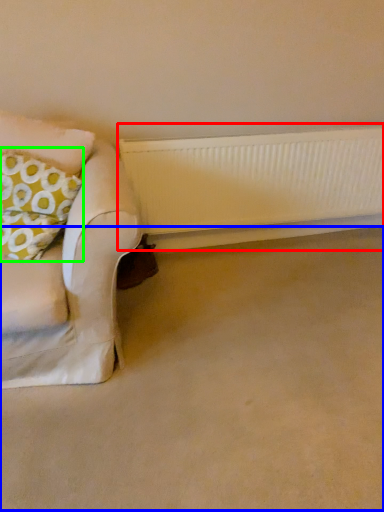
Question: Estimate the real-world distances between objects in this image. Which object is farther from radiator (highlighted by a red box), plain (highlighted by a blue box) or throw pillow (highlighted by a green box)?

Choices:
 (A) plain
 (B) throw pillow

Answer: (B)